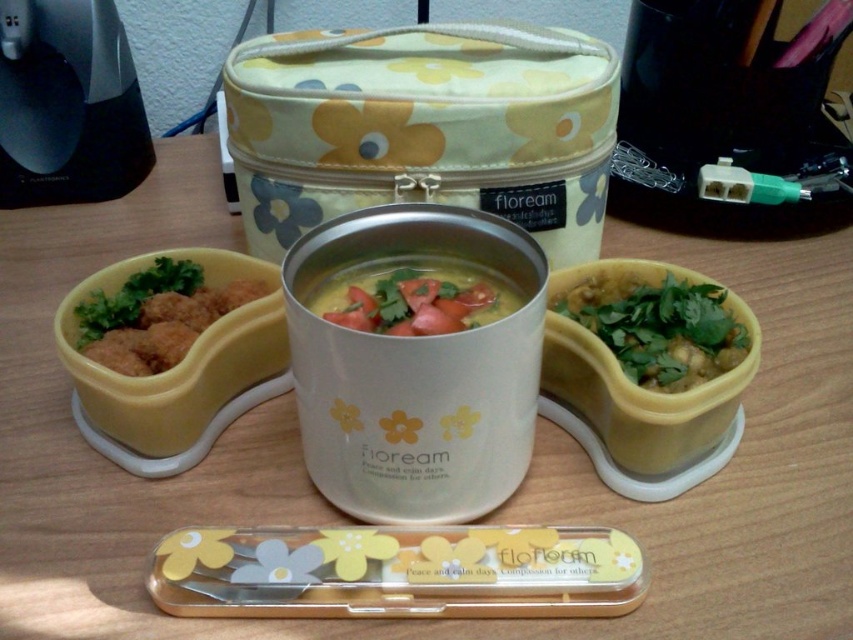
Question: Which point is farther from the camera taking this photo?

Choices:
 (A) (408, 269)
 (B) (599, 337)
 (C) (115, 305)

Answer: (C)

Question: Which object is positioned farthest from the green leafy garnish at center?

Choices:
 (A) yellow matte soup at center
 (B) brown matte chicken nuggets at left

Answer: (B)

Question: Can you confirm if green leafy garnish at center is positioned to the right of yellow matte soup at center?

Choices:
 (A) yes
 (B) no

Answer: (A)

Question: Considering the relative positions of green leafy garnish at center and yellow matte soup at center in the image provided, where is green leafy garnish at center located with respect to yellow matte soup at center?

Choices:
 (A) right
 (B) left

Answer: (A)

Question: Which object is farther from the camera taking this photo?

Choices:
 (A) green leafy garnish at center
 (B) yellow matte soup at center

Answer: (A)

Question: Does green leafy garnish at center appear on the right side of brown matte chicken nuggets at left?

Choices:
 (A) no
 (B) yes

Answer: (B)